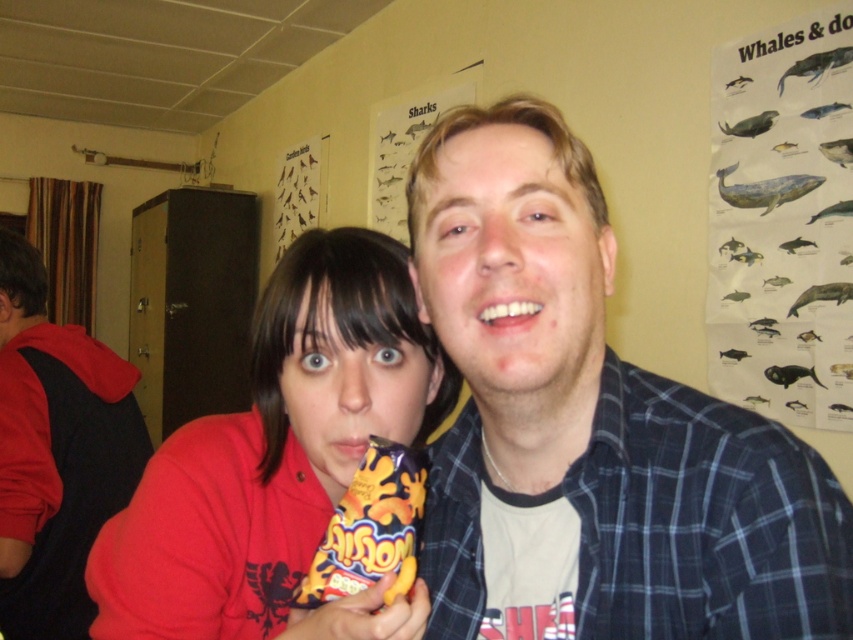
Question: Which point is farther from the camera taking this photo?

Choices:
 (A) (335, 468)
 (B) (727, 579)
 (C) (73, 458)
 (D) (351, 547)

Answer: (C)

Question: Which point is farther to the camera?

Choices:
 (A) (96, 554)
 (B) (341, 556)
 (C) (637, 468)

Answer: (A)

Question: Can you confirm if matte plastic bag of chips at center is positioned to the left of yellow matte bag of crisps at center?

Choices:
 (A) no
 (B) yes

Answer: (B)

Question: Can you confirm if matte plastic bag of chips at center is positioned to the left of yellow matte bag of crisps at center?

Choices:
 (A) yes
 (B) no

Answer: (A)

Question: Among these objects, which one is farthest from the camera?

Choices:
 (A) blue plaid shirt at center
 (B) yellow matte bag of crisps at center
 (C) red fleece sweatshirt at left

Answer: (C)

Question: In this image, where is matte plastic bag of chips at center located relative to red fleece sweatshirt at left?

Choices:
 (A) above
 (B) below

Answer: (A)